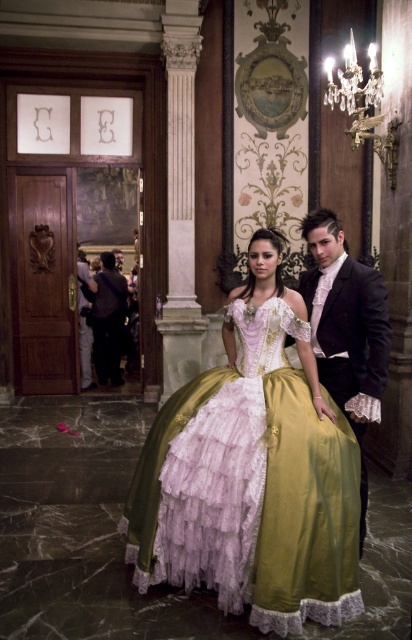
You are a photographer setting up for a photoshoot in this grand hall. You need to position a backdrop that is 1.8 meters tall. The lavender satin gown at center and the shiny black suit at center are both in the frame. Which of the two outfits will require adjusting their height to fit within the backdrop?

The lavender satin gown at center has a lesser height compared to the shiny black suit at center. Since the backdrop is 1.8 meters tall, the shiny black suit at center may need adjustment if its height exceeds the backdrop, while the lavender satin gown at center might already fit without adjustments.

You are a photographer setting up for a photoshoot in this grand hall. You need to position a light source so that it illuminates the shiny black suit at center without casting a shadow on the dark purple fabric at left. Is this possible given their current positions?

The shiny black suit at center is in front of the dark purple fabric at left, so positioning a light source behind the shiny black suit at center would cast a shadow on the dark purple fabric at left. Therefore, it is not possible to illuminate the shiny black suit at center without casting a shadow on the dark purple fabric at left in their current positions.